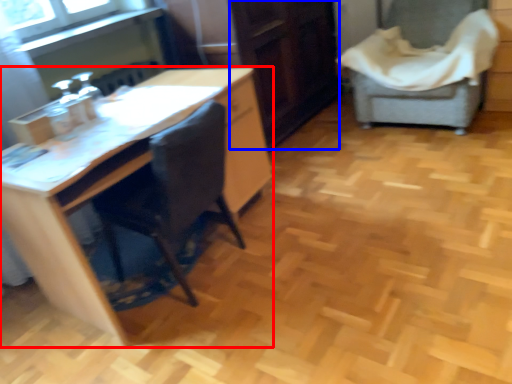
Question: Which object appears farthest to the camera in this image, desk (highlighted by a red box) or file cabinet (highlighted by a blue box)?

Choices:
 (A) desk
 (B) file cabinet

Answer: (B)